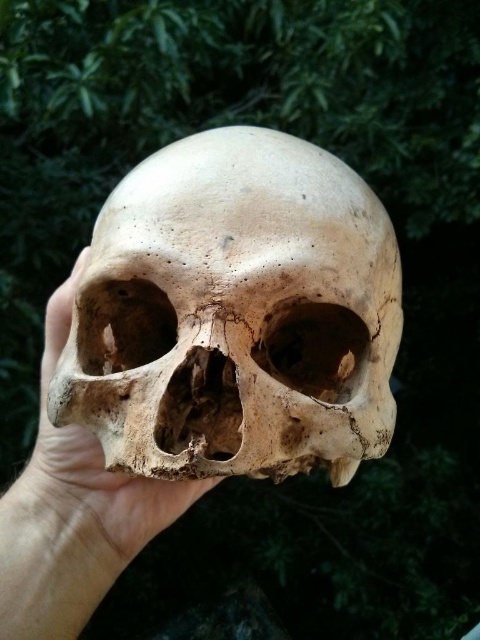
You are an archaeologist examining two skulls in a forest. You notice the matte bone skull at center and the smooth beige skull at center. Which one is positioned closer to your eyes?

The matte bone skull at center is closer to the viewer than the smooth beige skull at center.